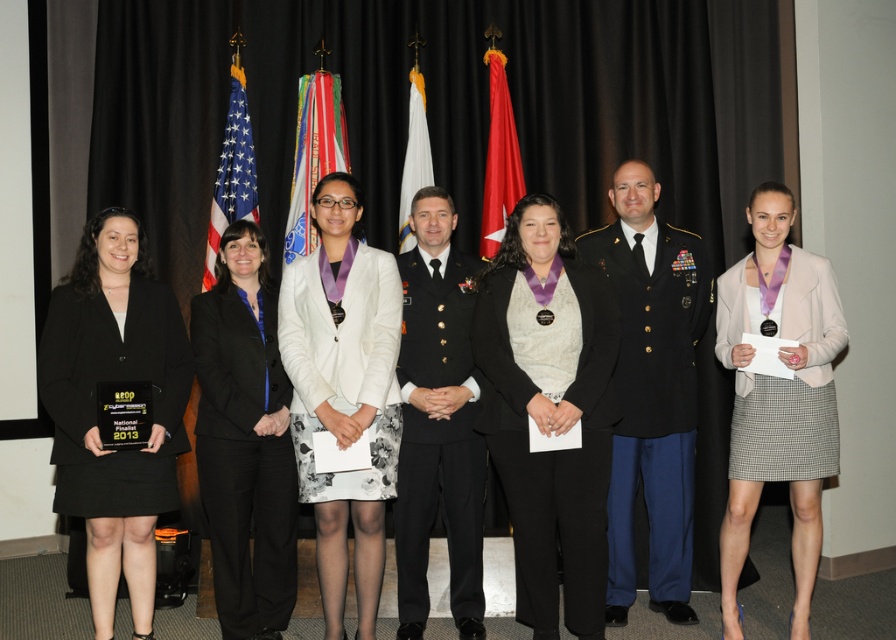
You are taking a photo of two points in the scene. The first point is at coordinate point (294, 451) and the second is at point (266, 353). Which point is closer to the camera?

Point (294, 451) is closer to the camera than point (266, 353).

In the group photo, there are two people wearing a white satin blazer at center and a shiny black uniform at center. Which one is covering part of the other?

The white satin blazer at center is positioned over the shiny black uniform at center, so it is covering part of it.